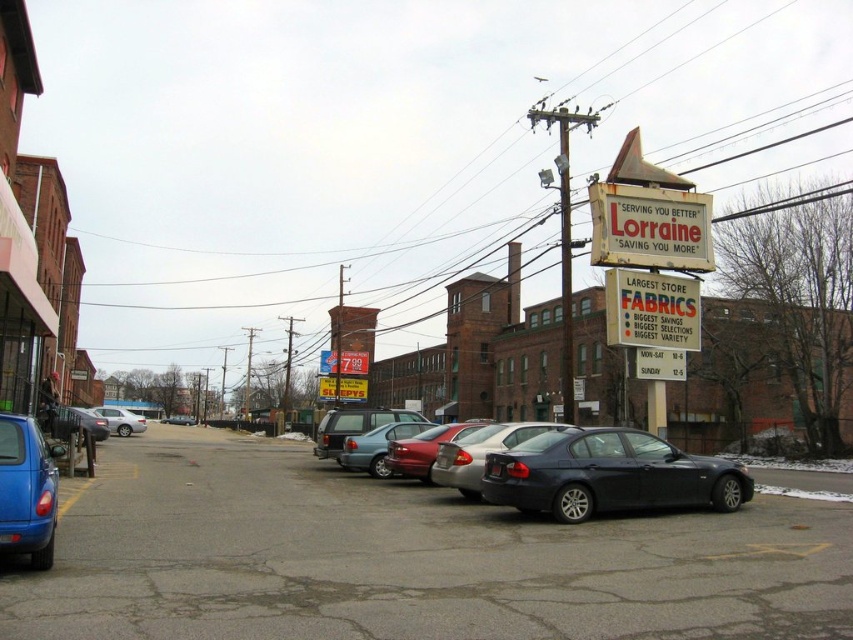
Question: Among these points, which one is farthest from the camera?

Choices:
 (A) (712, 586)
 (B) (357, 468)

Answer: (B)

Question: Is shiny black sedan at center to the right of metallic red sedan at center from the viewer's perspective?

Choices:
 (A) yes
 (B) no

Answer: (A)

Question: Estimate the real-world distances between objects in this image. Which object is farther from the shiny red sedan at center?

Choices:
 (A) white fabric sign at center-right
 (B) matte blue car at lower left

Answer: (B)

Question: Which point is farther to the camera?

Choices:
 (A) matte blue car at lower left
 (B) metallic red sedan at center
 (C) white fabric sign at center-right
 (D) wooden signboard at upper right

Answer: (B)

Question: Can you confirm if shiny red sedan at center is bigger than shiny black sedan at left?

Choices:
 (A) yes
 (B) no

Answer: (A)

Question: Does matte blue car at lower left have a smaller size compared to shiny black sedan at left?

Choices:
 (A) no
 (B) yes

Answer: (B)